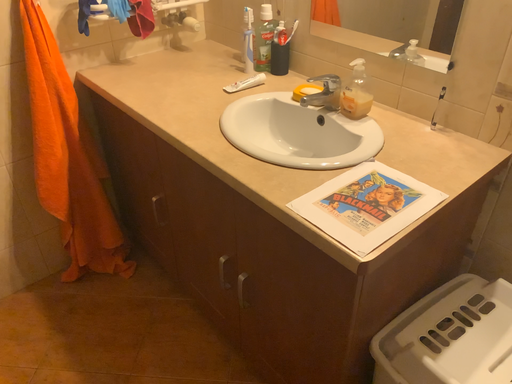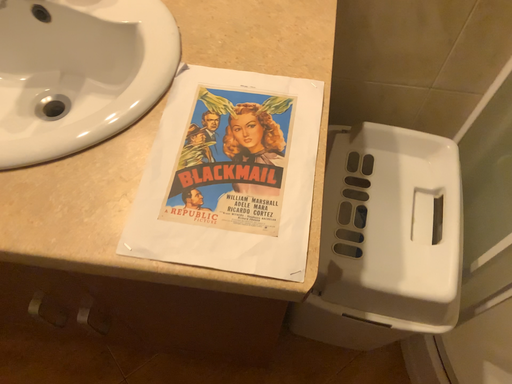
Question: How did the camera likely rotate when shooting the video?

Choices:
 (A) rotated upward
 (B) rotated downward

Answer: (B)